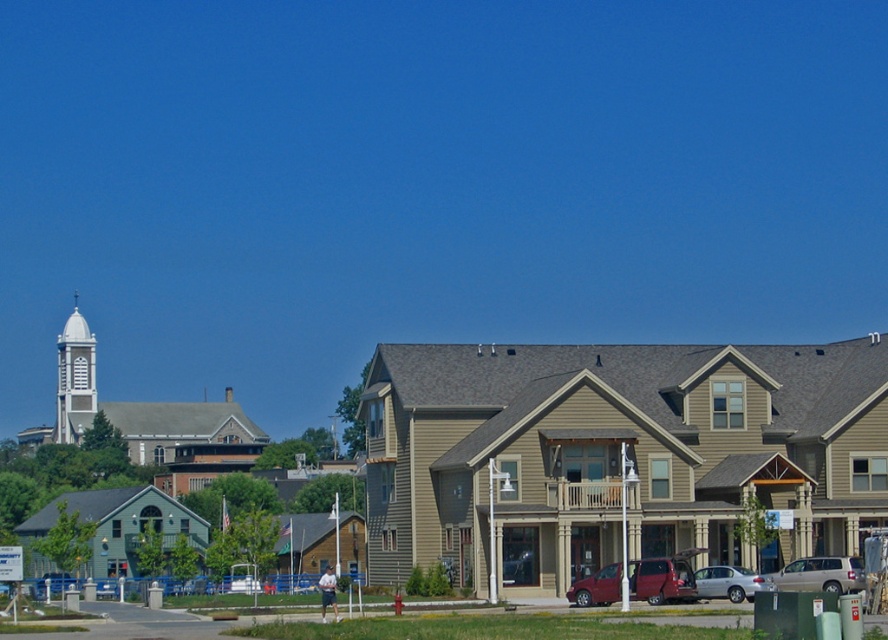
Question: Considering the real-world distances, which object is farthest from the silver metallic sedan at lower right?

Choices:
 (A) silver metallic minivan at lower right
 (B) metallic maroon van at center
 (C) white stucco spire at upper left

Answer: (C)

Question: Is silver metallic minivan at lower right to the left of silver metallic sedan at lower right from the viewer's perspective?

Choices:
 (A) yes
 (B) no

Answer: (B)

Question: Considering the real-world distances, which object is closest to the silver metallic sedan at lower right?

Choices:
 (A) metallic maroon van at center
 (B) white stucco spire at upper left

Answer: (A)

Question: Which of the following is the farthest from the observer?

Choices:
 (A) (741, 577)
 (B) (59, 429)
 (C) (801, 557)
 (D) (680, 573)

Answer: (B)

Question: Can you confirm if metallic maroon van at center is positioned below silver metallic minivan at lower right?

Choices:
 (A) yes
 (B) no

Answer: (B)

Question: Can you confirm if white stucco spire at upper left is wider than silver metallic minivan at lower right?

Choices:
 (A) yes
 (B) no

Answer: (A)